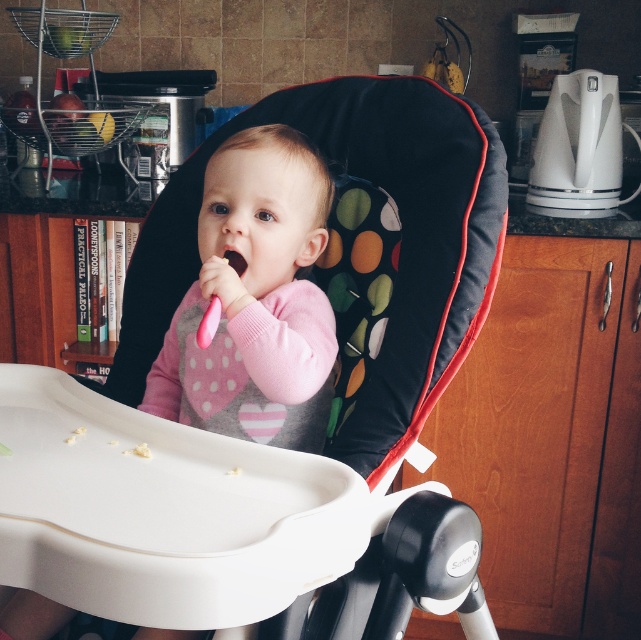
What do you see at coordinates (254, 300) in the screenshot? I see `pink soft toy at center` at bounding box center [254, 300].

Identify the location of pink soft toy at center. The width and height of the screenshot is (641, 640). (254, 300).

Is point (221, 296) more distant than point (237, 262)?

No, it is in front of (237, 262).

Where is `pink soft toy at center`? pink soft toy at center is located at coordinates (254, 300).

Does black fabric highchair at center have a smaller size compared to pink rubber toothbrush at center?

No.

Does point (142, 326) come farther from viewer compared to point (237, 268)?

Yes, it is.

You are a GUI agent. You are given a task and a screenshot of the screen. Output one action in this format:
    pyautogui.click(x=<x>, y=<y>)
    Task: Click on the black fabric highchair at center
    
    Given the screenshot: What is the action you would take?
    pyautogui.click(x=403, y=250)

Which is below, black fabric highchair at center or pink soft toy at center?

pink soft toy at center is below.

Which of these two, black fabric highchair at center or pink soft toy at center, stands shorter?

pink soft toy at center

Locate an element on the screen. This screenshot has width=641, height=640. black fabric highchair at center is located at coordinates (403, 250).

The image size is (641, 640). Find the location of `black fabric highchair at center`. black fabric highchair at center is located at coordinates (403, 250).